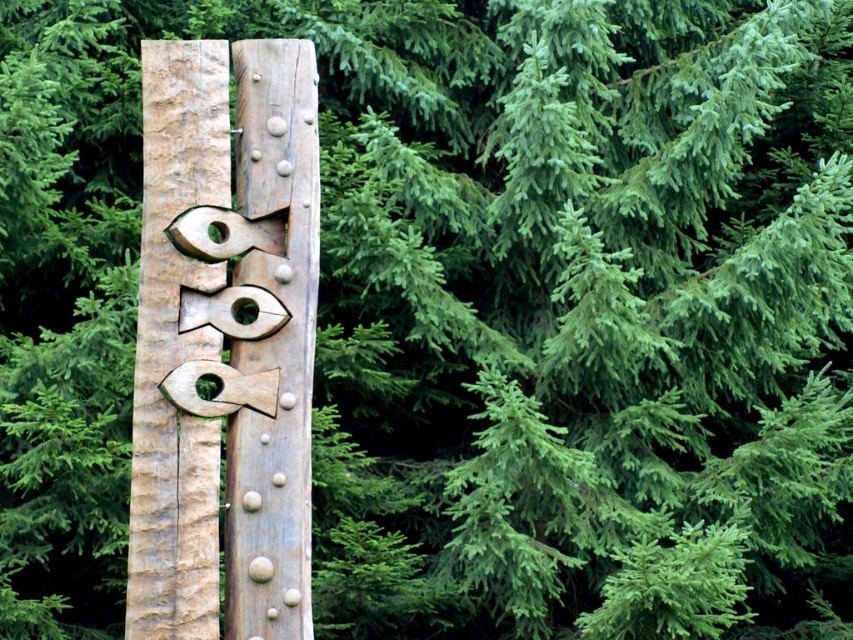
Is natural wood totem pole at center wider than wooden totem pole at center?

Indeed, natural wood totem pole at center has a greater width compared to wooden totem pole at center.

Consider the image. Does natural wood totem pole at center appear on the right side of wooden totem pole at center?

In fact, natural wood totem pole at center is to the left of wooden totem pole at center.

You are a GUI agent. You are given a task and a screenshot of the screen. Output one action in this format:
    pyautogui.click(x=<x>, y=<y>)
    Task: Click on the natural wood totem pole at center
    The width and height of the screenshot is (853, 640).
    Given the screenshot: What is the action you would take?
    pyautogui.click(x=221, y=342)